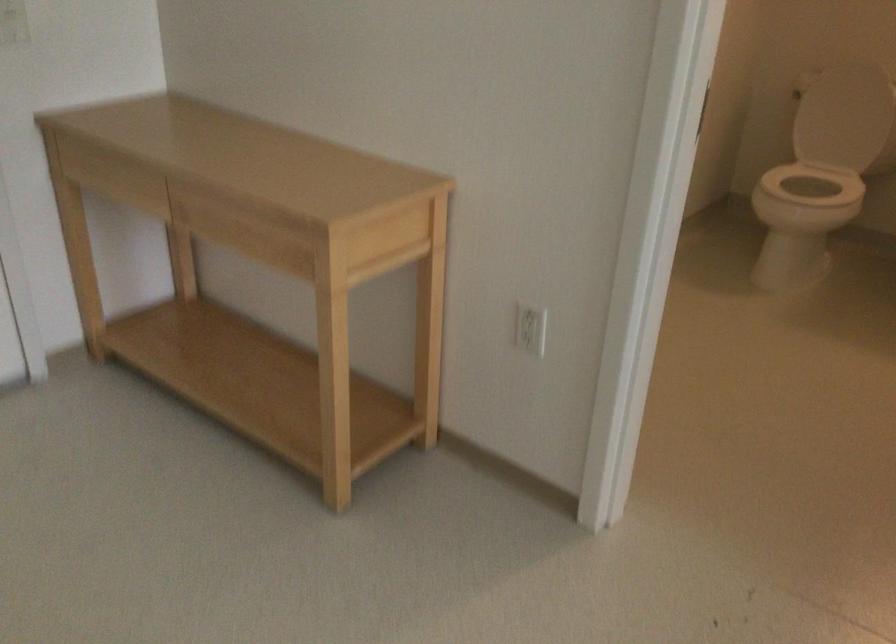
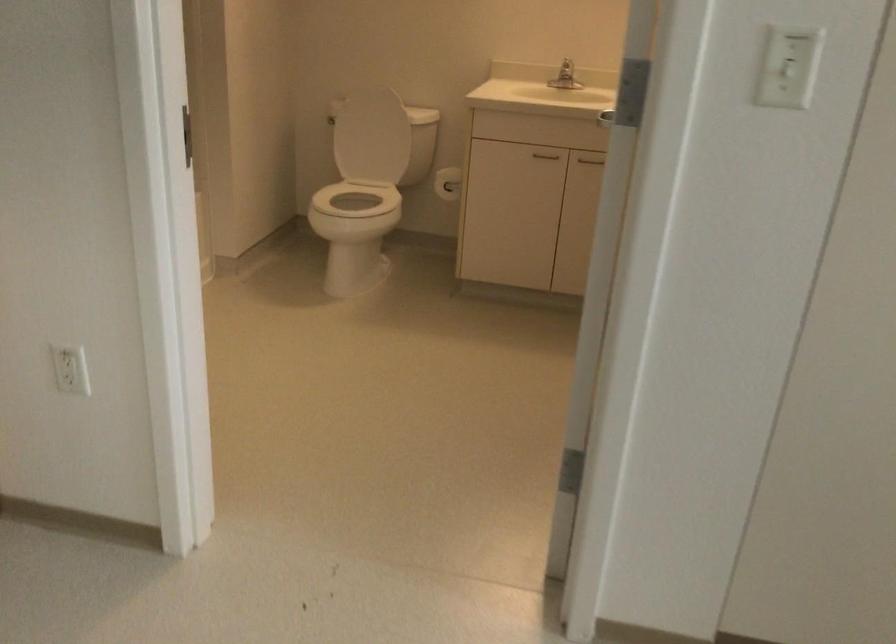
What movement of the cameraman would produce the second image?

The movement direction of the cameraman is right, backward.